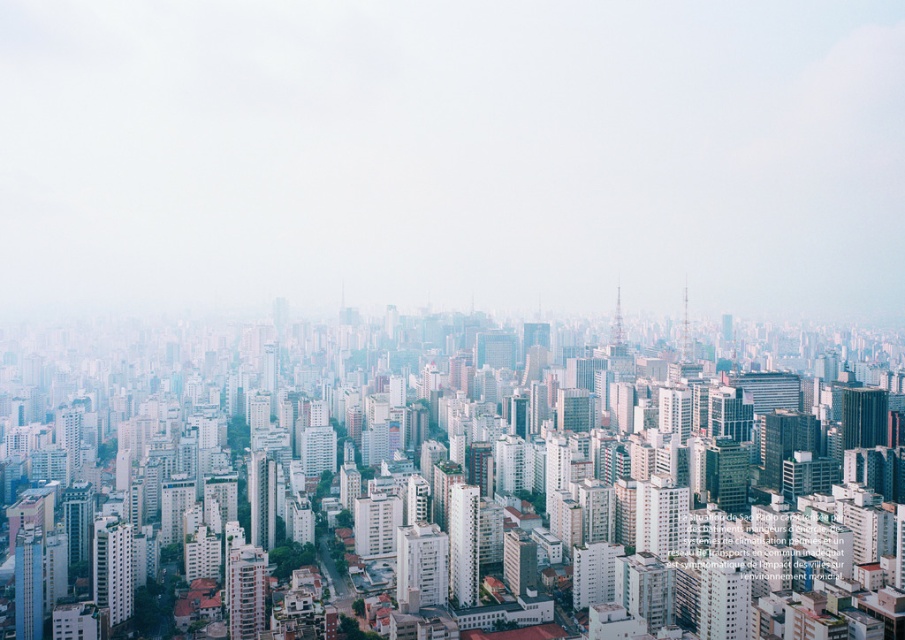
Question: Which point appears closest to the camera in this image?

Choices:
 (A) 467,540
 (B) 20,577
 (C) 262,547

Answer: (B)

Question: Can you confirm if white glass skyscraper at center is positioned above matte glass skyscraper at lower left?

Choices:
 (A) yes
 (B) no

Answer: (A)

Question: From the image, what is the correct spatial relationship of white glass skyscraper at center in relation to smooth glass skyscraper at center?

Choices:
 (A) right
 (B) left

Answer: (B)

Question: Which of these objects is positioned farthest from the smooth glass skyscraper at center?

Choices:
 (A) white foggy sky at upper center
 (B) smooth white building at center
 (C) matte glass skyscraper at lower left
 (D) smooth concrete building at lower left

Answer: (C)

Question: Considering the real-world distances, which object is farthest from the smooth white building at center?

Choices:
 (A) white glass skyscraper at center
 (B) matte glass skyscraper at lower left

Answer: (B)

Question: Does white glass skyscraper at center have a lesser width compared to smooth glass skyscraper at center?

Choices:
 (A) yes
 (B) no

Answer: (B)